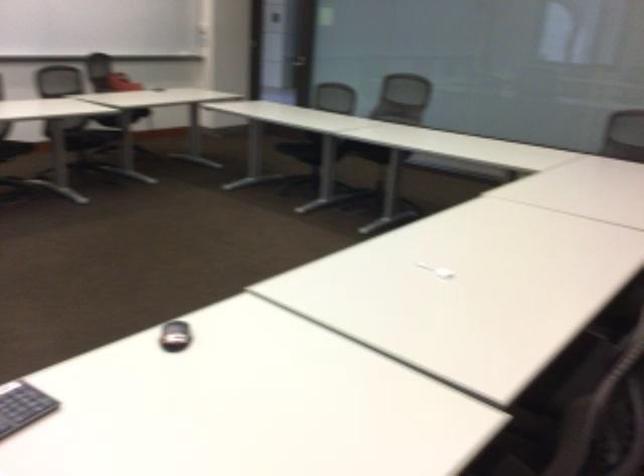
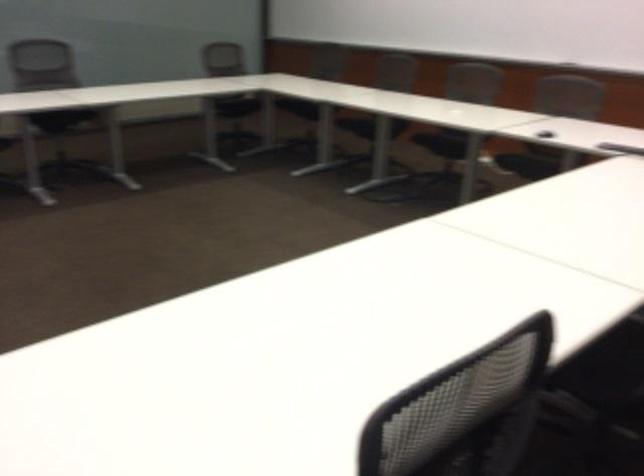
Question: In a continuous first-person perspective shot, in which direction is the camera moving?

Choices:
 (A) Left
 (B) Right
 (C) Forward
 (D) Backward

Answer: (D)